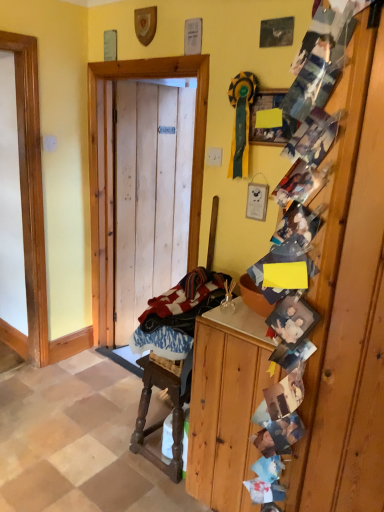
Question: Are wooden carved rocking chair at center and wooden door at center located far from each other?

Choices:
 (A) no
 (B) yes

Answer: (A)

Question: From a real-world perspective, is wooden carved rocking chair at center located higher than wooden door at center?

Choices:
 (A) no
 (B) yes

Answer: (A)

Question: Does wooden carved rocking chair at center touch wooden door at center?

Choices:
 (A) yes
 (B) no

Answer: (B)

Question: Considering the relative sizes of wooden carved rocking chair at center and wooden door at center in the image provided, is wooden carved rocking chair at center taller than wooden door at center?

Choices:
 (A) yes
 (B) no

Answer: (B)

Question: Does wooden carved rocking chair at center have a lesser width compared to wooden door at center?

Choices:
 (A) no
 (B) yes

Answer: (A)

Question: Considering their positions, is wooden cabinet at right located in front of or behind wooden carved rocking chair at center?

Choices:
 (A) front
 (B) behind

Answer: (A)

Question: Is point (195, 493) positioned closer to the camera than point (230, 281)?

Choices:
 (A) farther
 (B) closer

Answer: (B)

Question: From the image's perspective, relative to wooden carved rocking chair at center, is wooden cabinet at right above or below?

Choices:
 (A) above
 (B) below

Answer: (A)

Question: Based on their positions, is wooden cabinet at right located to the left or right of wooden carved rocking chair at center?

Choices:
 (A) right
 (B) left

Answer: (A)

Question: In the image, is wooden door at center on the left side or the right side of blue and white fabric at lower center?

Choices:
 (A) left
 (B) right

Answer: (A)

Question: From a real-world perspective, relative to blue and white fabric at lower center, is wooden door at center vertically above or below?

Choices:
 (A) above
 (B) below

Answer: (A)

Question: Is point (99, 264) positioned closer to the camera than point (172, 314)?

Choices:
 (A) farther
 (B) closer

Answer: (A)

Question: Relative to blue and white fabric at lower center, is wooden door at center in front or behind?

Choices:
 (A) front
 (B) behind

Answer: (B)

Question: Is point 135,339 closer or farther from the camera than point 140,418?

Choices:
 (A) farther
 (B) closer

Answer: (B)

Question: From their relative heights in the image, would you say blue and white fabric at lower center is taller or shorter than wooden carved rocking chair at center?

Choices:
 (A) short
 (B) tall

Answer: (A)